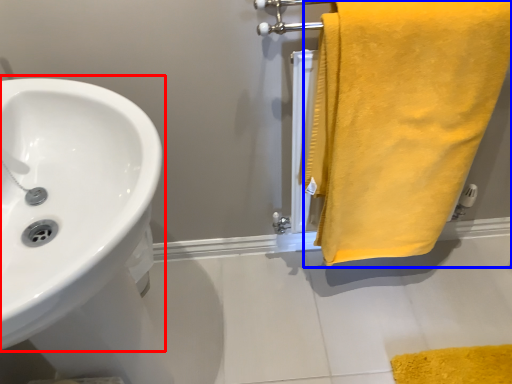
Question: Which point is further to the camera, sink (highlighted by a red box) or towel (highlighted by a blue box)?

Choices:
 (A) sink
 (B) towel

Answer: (B)